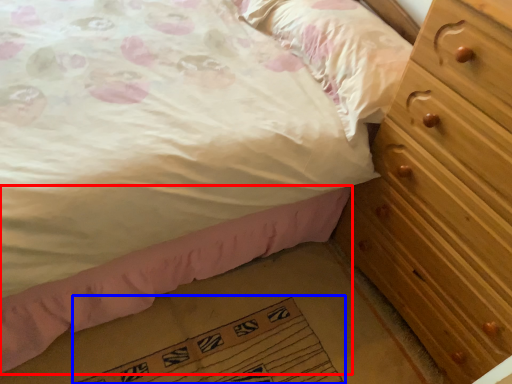
Question: Which object is further to the camera taking this photo, bed frame (highlighted by a red box) or doormat (highlighted by a blue box)?

Choices:
 (A) bed frame
 (B) doormat

Answer: (B)